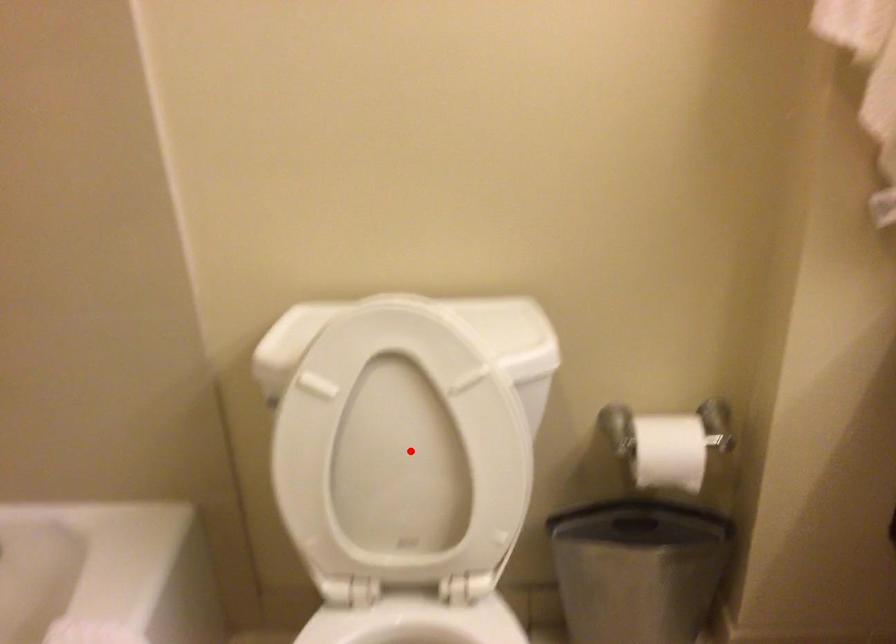
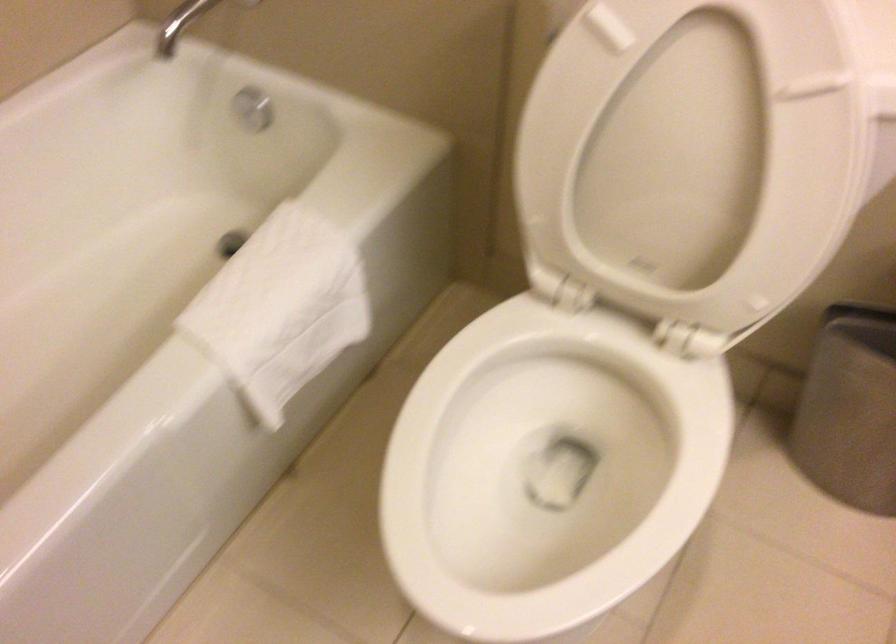
Question: I am providing you with two images of the same scene from different viewpoints. Given a red point in image1, look at the same physical point in image2. Is it:

Choices:
 (A) Closer to the viewpoint
 (B) Farther from the viewpoint

Answer: (A)